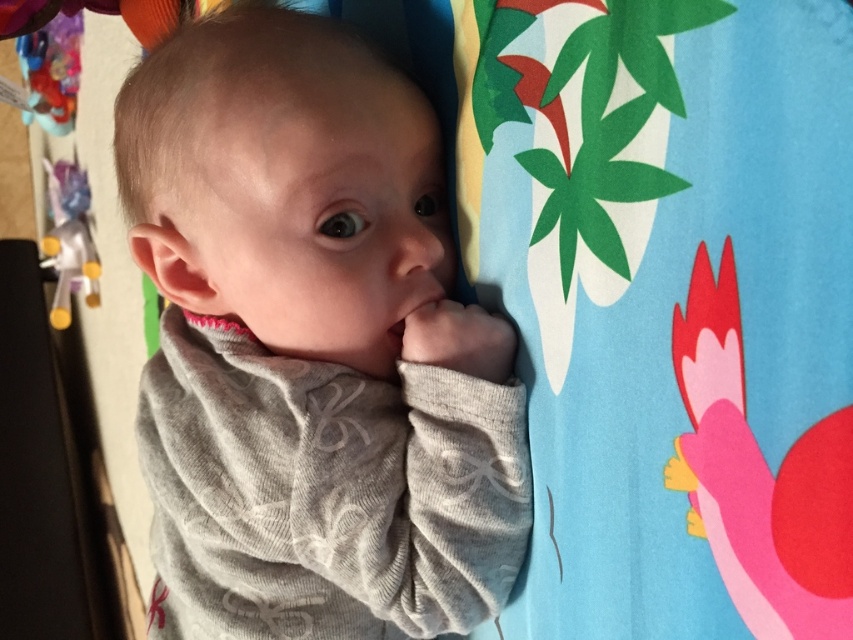
You are a parent trying to choose a toy for your baby. You see the yellow plastic toy at left and the plastic toy at upper left. Which toy is taller?

The yellow plastic toy at left is taller than the plastic toy at upper left according to the description.

You are a parent trying to choose a toy for your baby. You have the gray soft fabric baby at center and the yellow plastic toy at left in front of you. Which one is taller?

The gray soft fabric baby at center is taller than the yellow plastic toy at left.